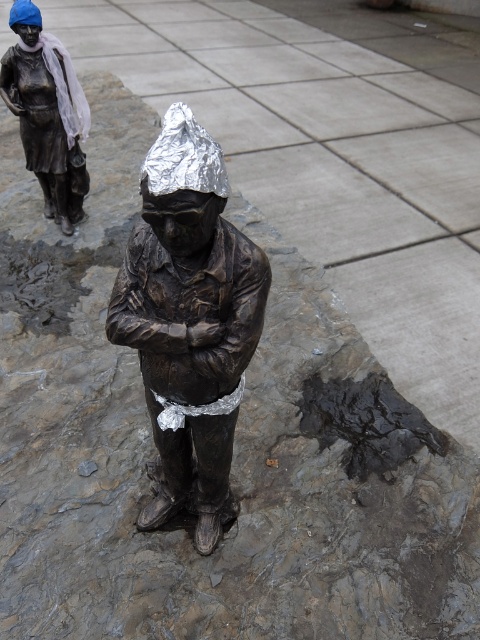
Question: Is bronze/statue at center smaller than bronze statue at upper left?

Choices:
 (A) yes
 (B) no

Answer: (B)

Question: Can you confirm if bronze/statue at center is positioned to the right of bronze statue at upper left?

Choices:
 (A) no
 (B) yes

Answer: (B)

Question: Which of the following is the farthest from the observer?

Choices:
 (A) bronze/statue at center
 (B) bronze statue at upper left

Answer: (B)

Question: Does bronze/statue at center have a lesser width compared to bronze statue at upper left?

Choices:
 (A) no
 (B) yes

Answer: (B)

Question: Which of the following is the farthest from the observer?

Choices:
 (A) bronze/statue at center
 (B) bronze statue at upper left

Answer: (B)

Question: Which point is closer to the camera?

Choices:
 (A) (36, 172)
 (B) (180, 182)

Answer: (B)